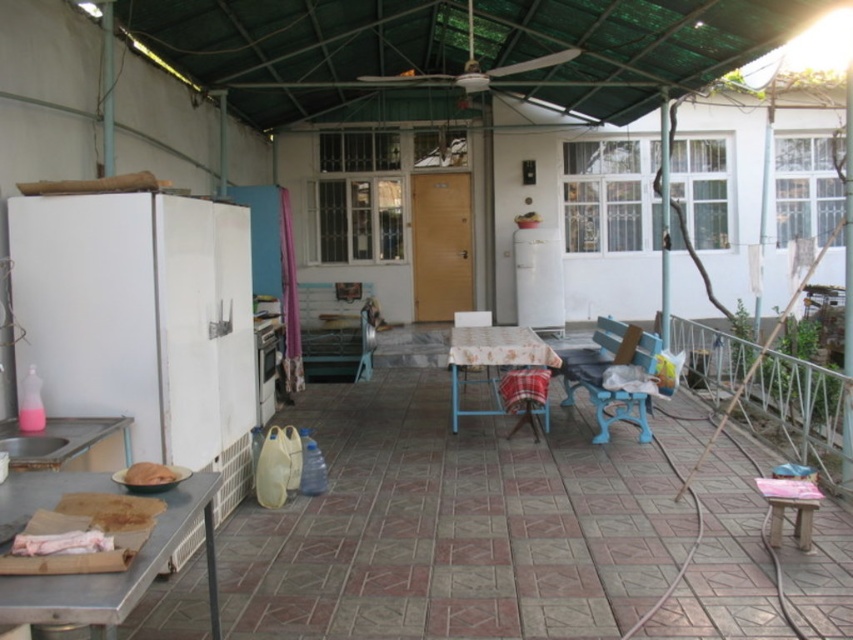
You are setting up a small table between the blue plastic chair at center and the white matte refrigerator at center. Which side of the refrigerator should the table be placed on to align with the chair?

The blue plastic chair at center is to the right of the white matte refrigerator at center, so the table should be placed on the right side of the refrigerator to align with the chair.

You are standing at the entrance of the patio and want to sit down. The blue plastic chair at center is located at point 0.598, 0.706. Can you reach the chair without crossing the green tarpaulin roof area?

The blue plastic chair at center is located at point (601, 381), which is within the patio area. Since the green tarpaulin roof covers part of the patio but the chair is positioned under it, you can reach the chair without crossing the roof area as it is already within the shaded region.